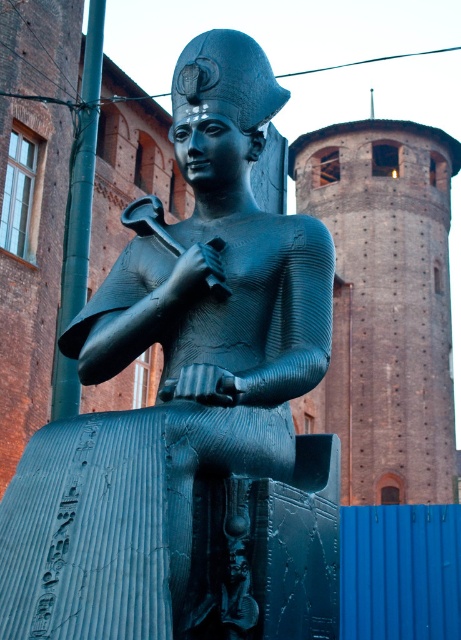
Question: Is bronze statue at center thinner than brick tower at upper center?

Choices:
 (A) no
 (B) yes

Answer: (B)

Question: Which of the following is the farthest from the observer?

Choices:
 (A) (141, 467)
 (B) (368, 307)

Answer: (B)

Question: Is bronze statue at center thinner than brick tower at upper center?

Choices:
 (A) no
 (B) yes

Answer: (B)

Question: Can you confirm if bronze statue at center is bigger than brick tower at upper center?

Choices:
 (A) yes
 (B) no

Answer: (B)